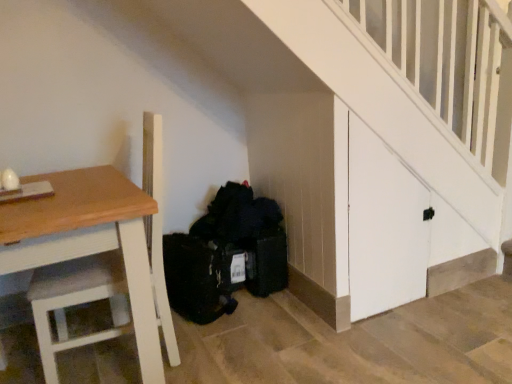
Question: Should I look upward or downward to see wooden table at left?

Choices:
 (A) up
 (B) down

Answer: (B)

Question: Is wooden table at left bigger than black fabric bag at lower center?

Choices:
 (A) no
 (B) yes

Answer: (B)

Question: Is wooden table at left outside black fabric bag at lower center?

Choices:
 (A) no
 (B) yes

Answer: (B)

Question: Is the position of wooden table at left less distant than that of black fabric bag at lower center?

Choices:
 (A) yes
 (B) no

Answer: (A)

Question: Considering the relative sizes of wooden table at left and black fabric bag at lower center in the image provided, is wooden table at left taller than black fabric bag at lower center?

Choices:
 (A) no
 (B) yes

Answer: (B)

Question: Is wooden table at left in contact with black fabric bag at lower center?

Choices:
 (A) yes
 (B) no

Answer: (B)

Question: Would you say wooden table at left contains black fabric bag at lower center?

Choices:
 (A) yes
 (B) no

Answer: (B)

Question: Is wooden table at left a part of black fabric bag at lower center?

Choices:
 (A) yes
 (B) no

Answer: (B)

Question: Would you consider black fabric bag at lower center to be distant from wooden table at left?

Choices:
 (A) yes
 (B) no

Answer: (B)

Question: Is black fabric bag at lower center smaller than wooden table at left?

Choices:
 (A) yes
 (B) no

Answer: (A)

Question: From a real-world perspective, is black fabric bag at lower center on top of wooden table at left?

Choices:
 (A) yes
 (B) no

Answer: (B)

Question: Considering the relative sizes of black fabric bag at lower center and wooden table at left in the image provided, is black fabric bag at lower center bigger than wooden table at left?

Choices:
 (A) yes
 (B) no

Answer: (B)

Question: Is black fabric bag at lower center further to camera compared to wooden table at left?

Choices:
 (A) no
 (B) yes

Answer: (B)

Question: From the image's perspective, relative to wooden table at left, is black fabric bag at lower center above or below?

Choices:
 (A) above
 (B) below

Answer: (A)